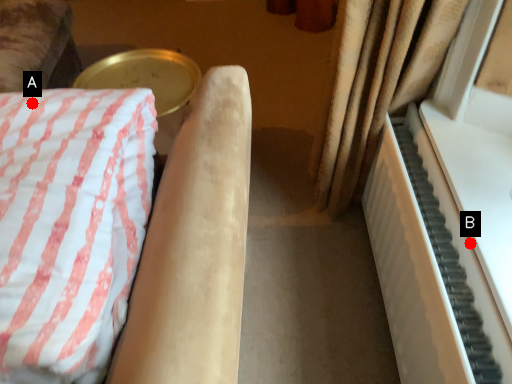
Question: Two points are circled on the image, labeled by A and B beside each circle. Among these points, which one is nearest to the camera?

Choices:
 (A) A is closer
 (B) B is closer

Answer: (A)